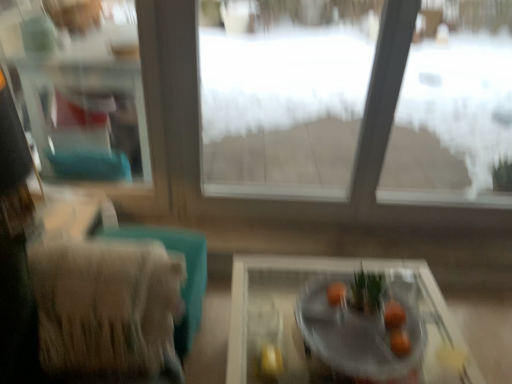
Question: Considering the relative sizes of clear glass window frame at upper left and orange matte at center in the image provided, is clear glass window frame at upper left shorter than orange matte at center?

Choices:
 (A) yes
 (B) no

Answer: (B)

Question: Is clear glass window frame at upper left aimed at orange matte at center?

Choices:
 (A) yes
 (B) no

Answer: (B)

Question: From a real-world perspective, is clear glass window frame at upper left physically below orange matte at center?

Choices:
 (A) no
 (B) yes

Answer: (A)

Question: Is clear glass window frame at upper left to the left of orange matte at center from the viewer's perspective?

Choices:
 (A) yes
 (B) no

Answer: (A)

Question: Considering the relative positions of clear glass window frame at upper left and orange matte at center in the image provided, is clear glass window frame at upper left behind orange matte at center?

Choices:
 (A) no
 (B) yes

Answer: (B)

Question: In terms of width, does clear glass bowl at center look wider or thinner when compared to transparent glass window at center?

Choices:
 (A) wide
 (B) thin

Answer: (A)

Question: From a real-world perspective, is clear glass bowl at center above or below transparent glass window at center?

Choices:
 (A) below
 (B) above

Answer: (A)

Question: Would you say clear glass bowl at center is to the left or to the right of transparent glass window at center in the picture?

Choices:
 (A) right
 (B) left

Answer: (A)

Question: Do you think clear glass bowl at center is within transparent glass window at center, or outside of it?

Choices:
 (A) outside
 (B) inside

Answer: (A)

Question: From a real-world perspective, is clear glass bowl at center above or below orange matte at center?

Choices:
 (A) above
 (B) below

Answer: (B)

Question: Is clear glass bowl at center wider or thinner than orange matte at center?

Choices:
 (A) wide
 (B) thin

Answer: (A)

Question: In terms of size, does clear glass bowl at center appear bigger or smaller than orange matte at center?

Choices:
 (A) big
 (B) small

Answer: (A)

Question: Is clear glass bowl at center taller or shorter than orange matte at center?

Choices:
 (A) short
 (B) tall

Answer: (B)

Question: From a real-world perspective, is clear glass window frame at upper left physically located above or below smooth orange fruit at center?

Choices:
 (A) above
 (B) below

Answer: (A)

Question: From their relative heights in the image, would you say clear glass window frame at upper left is taller or shorter than smooth orange fruit at center?

Choices:
 (A) tall
 (B) short

Answer: (A)